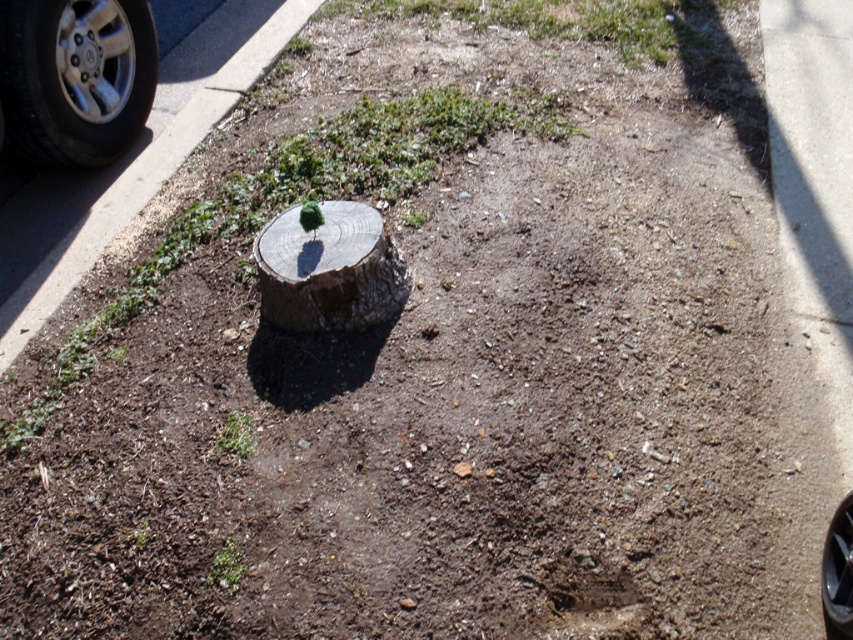
You are a delivery person trying to park your delivery van in this area. The van requires a parking space that is at least 2 meters wide. You see the silver metallic tire at upper left and the black rubber tire at lower right. Can you determine if the space between them is wide enough for the van?

The silver metallic tire at upper left is wider than the black rubber tire at lower right, so the space between them may be sufficient for the van, but the exact width isn

You are standing at the edge of the disturbed ground area and want to reach a point that is exactly 4.41 meters away from you. According to the image, is the point at coordinates point [119,90] within this distance?

The point [119,90] is exactly 4.41 meters away from the viewer, so yes, it is within the desired distance of 4.41 meters.

Looking at this image, you are standing in the disturbed ground area and want to place a flag at the point closest to you. Which point should you choose between point (357, 307) and point (839, 616)?

Point (357, 307) is further to the viewer than point (839, 616), so the closer point to you is point (357, 307). You should place the flag there.